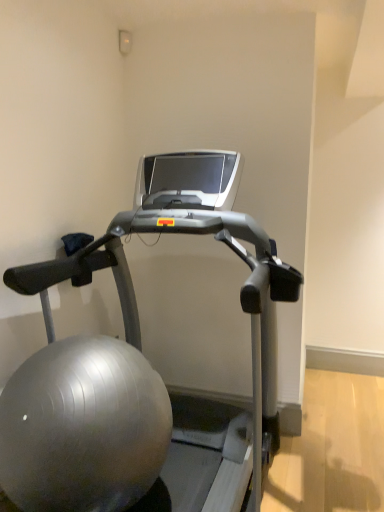
The height and width of the screenshot is (512, 384). What do you see at coordinates (143, 369) in the screenshot?
I see `silver metallic treadmill at center` at bounding box center [143, 369].

This screenshot has width=384, height=512. Find the location of `silver metallic treadmill at center`. silver metallic treadmill at center is located at coordinates (143, 369).

At what (x,y) coordinates should I click in order to perform the action: click on silver metallic treadmill at center. Please return your answer as a coordinate pair (x, y). The image size is (384, 512). Looking at the image, I should click on (143, 369).